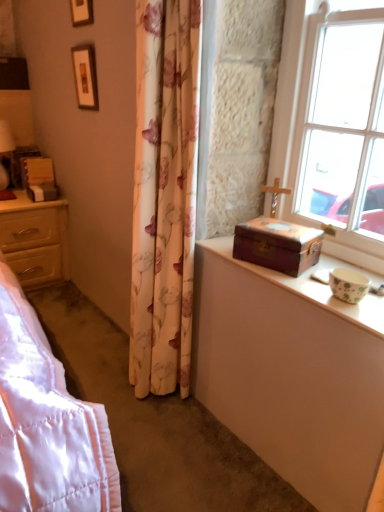
The image size is (384, 512). Describe the element at coordinates (81, 12) in the screenshot. I see `wooden picture frame at upper left, acting as the first picture frame starting from the top` at that location.

In order to face wooden chest at right, should I rotate leftwards or rightwards?

To face it directly, rotate right by 14.665 degrees.

Find the location of a particular element. This screenshot has height=512, width=384. floral fabric curtain at center is located at coordinates pos(164,194).

The image size is (384, 512). Find the location of `wooden at left`. wooden at left is located at coordinates (35, 239).

Considering the relative sizes of clear glass window at upper right and wooden chest at right in the image provided, is clear glass window at upper right shorter than wooden chest at right?

No.

Can you confirm if clear glass window at upper right is smaller than wooden chest at right?

Incorrect, clear glass window at upper right is not smaller in size than wooden chest at right.

Which object is wider, clear glass window at upper right or wooden chest at right?

With larger width is wooden chest at right.

Is clear glass window at upper right in front of or behind wooden chest at right in the image?

Clearly, clear glass window at upper right is in front of wooden chest at right.

From the image's perspective, who appears lower, matte white table lamp at left or wooden treasure chest at window sill?

wooden treasure chest at window sill appears lower in the image.

Is matte white table lamp at left in contact with wooden treasure chest at window sill?

No, matte white table lamp at left is not with wooden treasure chest at window sill.

From the picture: Is wooden treasure chest at window sill at the back of matte white table lamp at left?

No.

Is point (8, 148) positioned in front of point (276, 245)?

No, (8, 148) is behind (276, 245).

Which of these two, wooden picture frame at upper left, arranged as the second picture frame when viewed from the top, or floral fabric curtain at center, stands shorter?

wooden picture frame at upper left, arranged as the second picture frame when viewed from the top, is shorter.

Can you see wooden picture frame at upper left, which is the 1th picture frame from bottom to top, touching floral fabric curtain at center?

They are not placed beside each other.

Does wooden picture frame at upper left, arranged as the second picture frame when viewed from the top, have a lesser width compared to floral fabric curtain at center?

Yes, wooden picture frame at upper left, arranged as the second picture frame when viewed from the top, is thinner than floral fabric curtain at center.

What's the angular difference between wooden picture frame at upper left, arranged as the second picture frame when viewed from the top, and floral fabric curtain at center's facing directions?

0.000736 degrees separate the facing orientations of wooden picture frame at upper left, arranged as the second picture frame when viewed from the top, and floral fabric curtain at center.

From the picture: Is floral fabric curtain at center not inside clear glass window at upper right?

floral fabric curtain at center is positioned outside clear glass window at upper right.

Can you tell me how much floral fabric curtain at center and clear glass window at upper right differ in facing direction?

The angular difference between floral fabric curtain at center and clear glass window at upper right is 0.0334 degrees.

Which of these two, floral fabric curtain at center or clear glass window at upper right, is smaller?

With smaller size is clear glass window at upper right.

Is point (182, 57) positioned before point (320, 16)?

Yes, it is in front of point (320, 16).

Consider the image. From the image's perspective, would you say wooden picture frame at upper left, arranged as the second picture frame when viewed from the top, is shown under wooden chest at right?

No, from the image's perspective, wooden picture frame at upper left, arranged as the second picture frame when viewed from the top, is not below wooden chest at right.

Does point (97, 109) lie behind point (356, 324)?

Yes.

Is there a large distance between wooden picture frame at upper left, which is the 1th picture frame from bottom to top, and wooden chest at right?

Yes, wooden picture frame at upper left, which is the 1th picture frame from bottom to top, and wooden chest at right are quite far apart.

Which of these two, wooden picture frame at upper left, placed as the 2th picture frame when sorted from bottom to top, or clear glass window at upper right, is bigger?

clear glass window at upper right is bigger.

Is wooden picture frame at upper left, placed as the 2th picture frame when sorted from bottom to top, in front of clear glass window at upper right?

No, wooden picture frame at upper left, placed as the 2th picture frame when sorted from bottom to top, is further to the viewer.

Considering the relative positions of wooden picture frame at upper left, acting as the first picture frame starting from the top, and clear glass window at upper right in the image provided, is wooden picture frame at upper left, acting as the first picture frame starting from the top, to the right of clear glass window at upper right from the viewer's perspective?

In fact, wooden picture frame at upper left, acting as the first picture frame starting from the top, is to the left of clear glass window at upper right.

Is clear glass window at upper right at the back of matte white table lamp at left?

No, matte white table lamp at left's orientation is not away from clear glass window at upper right.

From a real-world perspective, which object stands above the other?

clear glass window at upper right, from a real-world perspective.

Which is behind, point (6, 125) or point (368, 255)?

The point (6, 125) is behind.

The image size is (384, 512). I want to click on window above the wooden chest at right (from a real-world perspective), so click(x=299, y=95).

This screenshot has width=384, height=512. I want to click on box lying on the right of matte white table lamp at left, so click(277, 245).

Looking at the image, which one is located closer to clear glass window at upper right, wooden treasure chest at window sill or wooden chest at right?

The object closer to clear glass window at upper right is wooden treasure chest at window sill.

Looking at the image, which one is located closer to clear glass window at upper right, matte white table lamp at left or wooden at left?

wooden at left is positioned closer to the anchor clear glass window at upper right.

Which object lies further to the anchor point floral fabric curtain at center, wooden at left or wooden picture frame at upper left, arranged as the second picture frame when viewed from the top?

Based on the image, wooden at left appears to be further to floral fabric curtain at center.

When comparing their distances from wooden picture frame at upper left, placed as the 2th picture frame when sorted from bottom to top, does wooden at left or wooden picture frame at upper left, arranged as the second picture frame when viewed from the top, seem closer?

wooden picture frame at upper left, arranged as the second picture frame when viewed from the top, lies closer to wooden picture frame at upper left, placed as the 2th picture frame when sorted from bottom to top, than the other object.

When comparing their distances from wooden chest at right, does wooden picture frame at upper left, acting as the first picture frame starting from the top, or matte white table lamp at left seem further?

matte white table lamp at left.

Looking at the image, which one is located closer to floral fabric curtain at center, wooden picture frame at upper left, placed as the 2th picture frame when sorted from bottom to top, or wooden picture frame at upper left, arranged as the second picture frame when viewed from the top?

wooden picture frame at upper left, arranged as the second picture frame when viewed from the top, is positioned closer to the anchor floral fabric curtain at center.

Looking at the image, which one is located closer to wooden at left, wooden treasure chest at window sill or wooden chest at right?

wooden chest at right is positioned closer to the anchor wooden at left.

From the image, which object appears to be nearer to wooden picture frame at upper left, acting as the first picture frame starting from the top, matte white table lamp at left or wooden treasure chest at window sill?

Among the two, matte white table lamp at left is located nearer to wooden picture frame at upper left, acting as the first picture frame starting from the top.

Identify the location of desk situated between matte white table lamp at left and wooden chest at right from left to right. This screenshot has height=512, width=384. (35, 239).

The height and width of the screenshot is (512, 384). Find the location of `picture frame between wooden picture frame at upper left, placed as the 2th picture frame when sorted from bottom to top, and wooden treasure chest at window sill, in the vertical direction`. picture frame between wooden picture frame at upper left, placed as the 2th picture frame when sorted from bottom to top, and wooden treasure chest at window sill, in the vertical direction is located at coordinates (85, 76).

You are a GUI agent. You are given a task and a screenshot of the screen. Output one action in this format:
    pyautogui.click(x=<x>, y=<y>)
    Task: Click on the box between wooden picture frame at upper left, arranged as the second picture frame when viewed from the top, and clear glass window at upper right, in the horizontal direction
    The width and height of the screenshot is (384, 512).
    Given the screenshot: What is the action you would take?
    pyautogui.click(x=277, y=245)

Identify the location of box between wooden at left and wooden chest at right in the horizontal direction. The width and height of the screenshot is (384, 512). (277, 245).